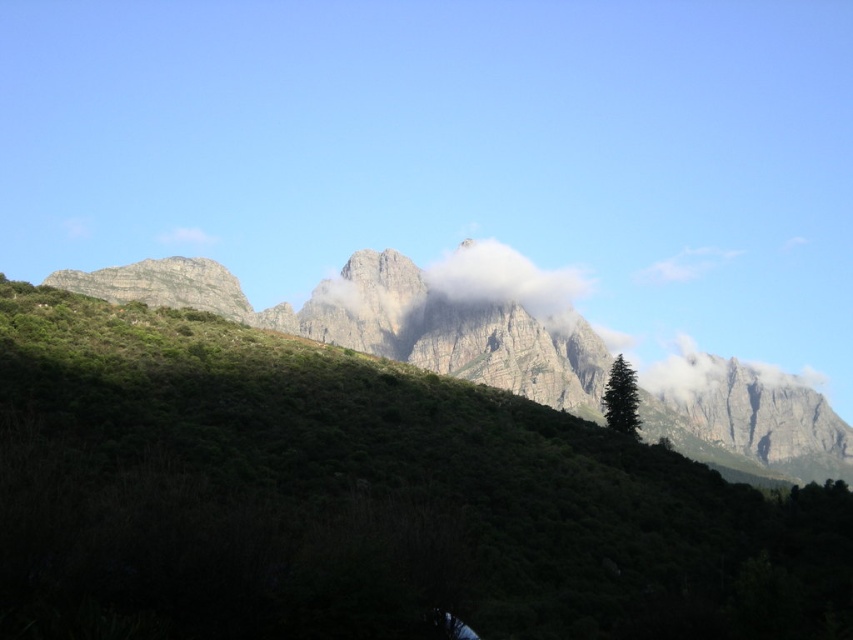
You are an observer looking at the mountain landscape. You notice the green textured hillside at center and the white fluffy cloud at center. Which object is closer to you?

The green textured hillside at center is closer to you because it is positioned under the white fluffy cloud at center, meaning the cloud is above it in the scene.

You are a hiker standing at the starting point of a trail. You see the green textured hillside at center in front of you. If you walk straight towards it, will you reach the hillside before your 200 feet water supply runs out?

The green textured hillside at center is 191.72 feet away from you. Since your water supply lasts for 200 feet, you will reach the hillside before running out of water.

You are standing at a viewpoint overlooking the mountain landscape. You notice two points marked on your map. The first point is at coordinate point (1, 531), and the second is at point (486, 246). Which point is closer to you based on their positions in the scene?

Point (1, 531) is in front of point (486, 246), so it is closer to your current position.